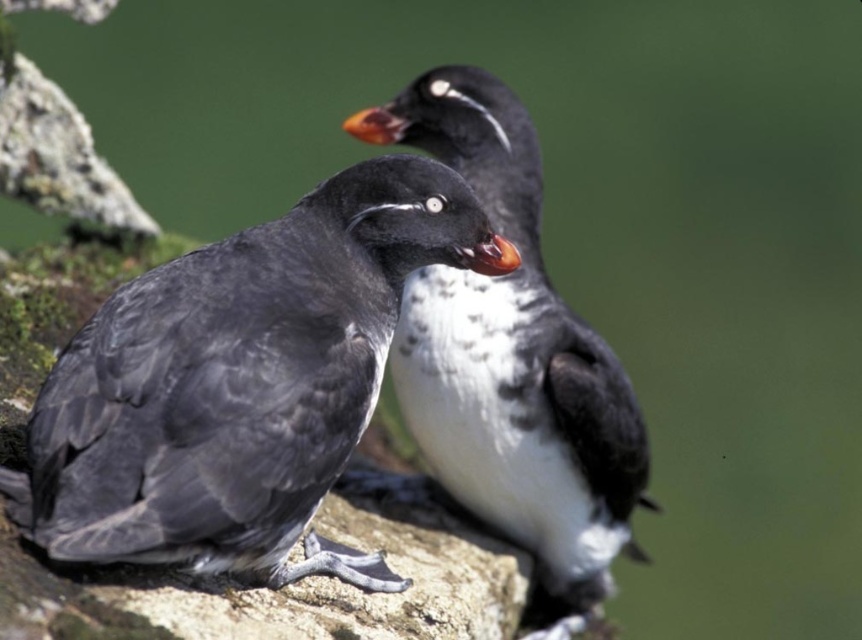
Question: Is matte black bird at left thinner than black feathered bird at center?

Choices:
 (A) yes
 (B) no

Answer: (A)

Question: Among these points, which one is nearest to the camera?

Choices:
 (A) (61, 470)
 (B) (522, 273)

Answer: (A)

Question: Does matte black bird at left appear on the left side of black feathered bird at center?

Choices:
 (A) yes
 (B) no

Answer: (A)

Question: Which object is closer to the camera taking this photo?

Choices:
 (A) matte black bird at left
 (B) black feathered bird at center

Answer: (A)

Question: From the image, what is the correct spatial relationship of matte black bird at left in relation to black feathered bird at center?

Choices:
 (A) right
 (B) left

Answer: (B)